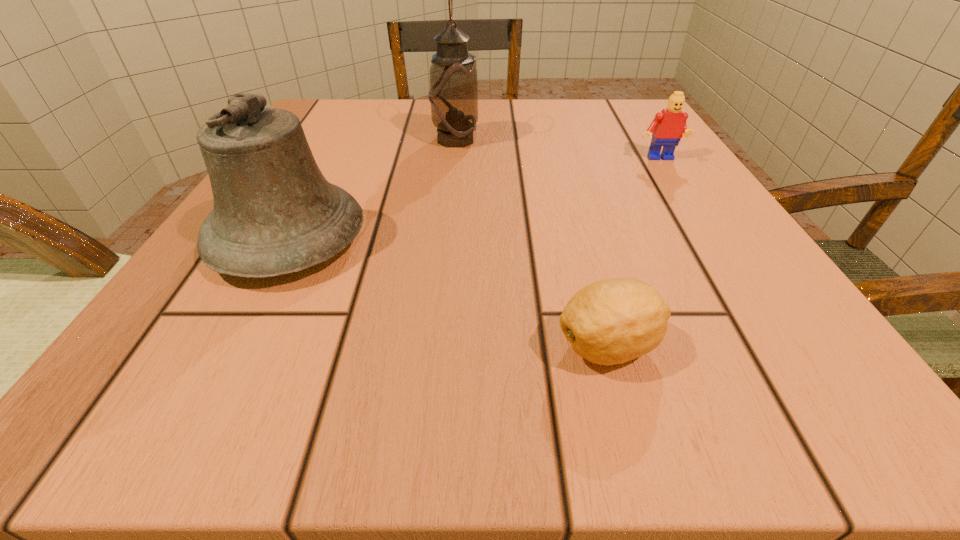
Where is `free region located 0.380m on the front-facing side of the second shortest object`? free region located 0.380m on the front-facing side of the second shortest object is located at coordinates click(763, 325).

You are a GUI agent. You are given a task and a screenshot of the screen. Output one action in this format:
    pyautogui.click(x=<x>, y=<y>)
    Task: Click on the blank space located 0.150m at the stem end of the lemon
    This screenshot has height=540, width=960.
    Given the screenshot: What is the action you would take?
    pyautogui.click(x=416, y=346)

Where is `blank space located at the stem end of the lemon`? This screenshot has height=540, width=960. blank space located at the stem end of the lemon is located at coordinates (471, 346).

At what (x,y) coordinates should I click in order to perform the action: click on free region located 0.290m at the stem end of the lemon. Please return your answer as a coordinate pair (x, y). Image resolution: width=960 pixels, height=540 pixels. Looking at the image, I should click on (287, 346).

Locate an element on the screen. The width and height of the screenshot is (960, 540). object that is at the far edge is located at coordinates (453, 95).

Locate an element on the screen. Image resolution: width=960 pixels, height=540 pixels. object situated at the near edge is located at coordinates (612, 321).

Where is `object that is at the left edge`? Image resolution: width=960 pixels, height=540 pixels. object that is at the left edge is located at coordinates (274, 213).

I want to click on object that is positioned at the right edge, so click(668, 126).

The height and width of the screenshot is (540, 960). What are the coordinates of `vacant region at the far edge` in the screenshot? It's located at (532, 113).

In the image, there is a desktop. What are the coordinates of `vacant space at the near edge` in the screenshot? It's located at (389, 414).